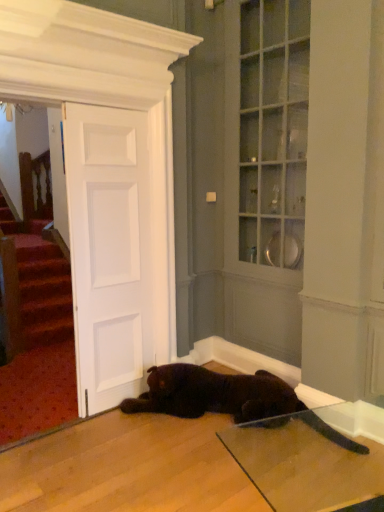
This screenshot has height=512, width=384. Find the location of `white matte door at center`. white matte door at center is located at coordinates (109, 251).

What do you see at coordinates (109, 251) in the screenshot?
I see `white matte door at center` at bounding box center [109, 251].

I want to click on shiny black cat at lower center, so click(x=229, y=400).

The width and height of the screenshot is (384, 512). What do you see at coordinates (229, 400) in the screenshot? I see `shiny black cat at lower center` at bounding box center [229, 400].

Identify the location of white matte door at center. The width and height of the screenshot is (384, 512). 109,251.

In the scene shown: Can you confirm if shiny black cat at lower center is positioned to the right of white matte door at center?

Yes, shiny black cat at lower center is to the right of white matte door at center.

Is the depth of shiny black cat at lower center less than that of white matte door at center?

Yes, it is.

Does point (243, 385) lie behind point (122, 227)?

Yes.

From the image's perspective, which is below, shiny black cat at lower center or white matte door at center?

shiny black cat at lower center, from the image's perspective.

From a real-world perspective, is shiny black cat at lower center under white matte door at center?

Yes, from a real-world perspective, shiny black cat at lower center is under white matte door at center.

Based on the photo, which of these two, shiny black cat at lower center or white matte door at center, is thinner?

With smaller width is white matte door at center.

Which of these two, shiny black cat at lower center or white matte door at center, stands shorter?

Standing shorter between the two is shiny black cat at lower center.

In terms of size, does shiny black cat at lower center appear bigger or smaller than white matte door at center?

Considering their sizes, shiny black cat at lower center takes up more space than white matte door at center.

Is shiny black cat at lower center not inside white matte door at center?

Absolutely, shiny black cat at lower center is external to white matte door at center.

Is shiny black cat at lower center not close to white matte door at center?

No, there isn't a large distance between shiny black cat at lower center and white matte door at center.

Based on the photo, could you tell me if shiny black cat at lower center is facing white matte door at center?

No, shiny black cat at lower center is not aimed at white matte door at center.

The height and width of the screenshot is (512, 384). Identify the location of door located behind the shiny black cat at lower center. (109, 251).

Considering the relative positions of white matte door at center and shiny black cat at lower center in the image provided, is white matte door at center to the left of shiny black cat at lower center from the viewer's perspective?

Yes.

Which object is more forward, white matte door at center or shiny black cat at lower center?

shiny black cat at lower center is more forward.

Does point (107, 258) lie behind point (187, 368)?

No, it is in front of (187, 368).

From the image's perspective, between white matte door at center and shiny black cat at lower center, who is located below?

shiny black cat at lower center, from the image's perspective.

From the picture: From a real-world perspective, is white matte door at center on shiny black cat at lower center?

Correct, in the physical world, white matte door at center is higher than shiny black cat at lower center.

Is white matte door at center thinner than shiny black cat at lower center?

Indeed, white matte door at center has a lesser width compared to shiny black cat at lower center.

Between white matte door at center and shiny black cat at lower center, which one has less height?

shiny black cat at lower center is shorter.

In the scene shown: Does white matte door at center have a larger size compared to shiny black cat at lower center?

Actually, white matte door at center might be smaller than shiny black cat at lower center.

In the scene shown: Do you think white matte door at center is within shiny black cat at lower center, or outside of it?

white matte door at center exists outside the volume of shiny black cat at lower center.

Is white matte door at center in contact with shiny black cat at lower center?

No, white matte door at center is not with shiny black cat at lower center.

Is white matte door at center aimed at shiny black cat at lower center?

No, white matte door at center is not aimed at shiny black cat at lower center.

Find the location of a particular element. cat located below the white matte door at center (from the image's perspective) is located at coordinates (229, 400).

Identify the location of cat below the white matte door at center (from the image's perspective). The height and width of the screenshot is (512, 384). (229, 400).

Where is `door behind the shiny black cat at lower center`? This screenshot has height=512, width=384. door behind the shiny black cat at lower center is located at coordinates (109, 251).